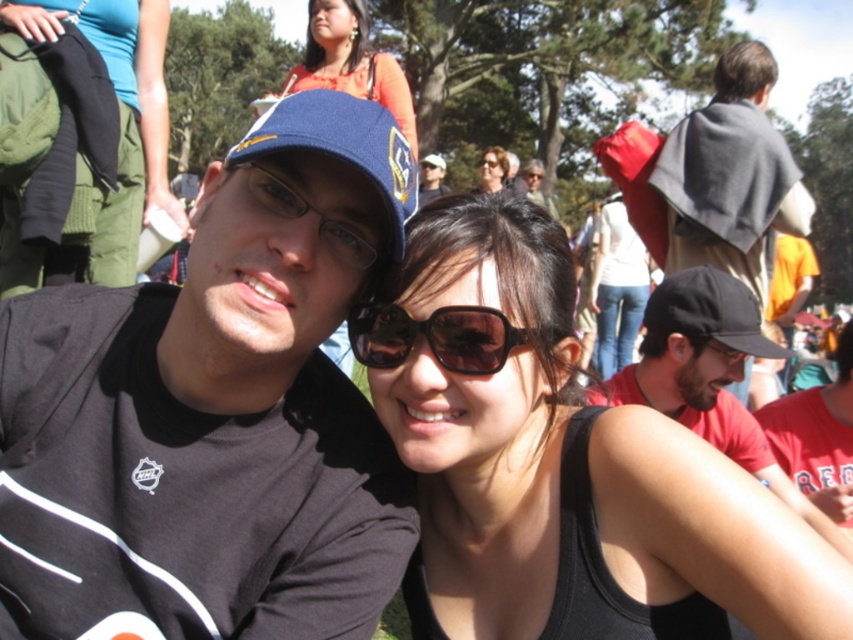
Question: Which object is the closest to the black fabric shirt at center?

Choices:
 (A) dark gray fabric cape at upper right
 (B) orange fabric shirt at upper center
 (C) matte black cap at center
 (D) brown matte sunglasses at center

Answer: (B)

Question: Can you confirm if black fabric shirt at center is positioned above matte black cap at upper center?

Choices:
 (A) yes
 (B) no

Answer: (B)

Question: Does dark gray fabric cape at upper right appear on the left side of brown matte sunglasses at center?

Choices:
 (A) yes
 (B) no

Answer: (B)

Question: Can you confirm if green fabric pants at center is positioned to the right of matte blue cap at upper center?

Choices:
 (A) yes
 (B) no

Answer: (B)

Question: Considering the real-world distances, which object is farthest from the matte blue cap at upper center?

Choices:
 (A) black matte sunglasses at center
 (B) black plastic glasses at center
 (C) black plastic sunglasses at center
 (D) black fabric baseball cap at right

Answer: (B)

Question: Which point is farther from the camera taking this photo?

Choices:
 (A) pos(219,456)
 (B) pos(694,189)

Answer: (B)